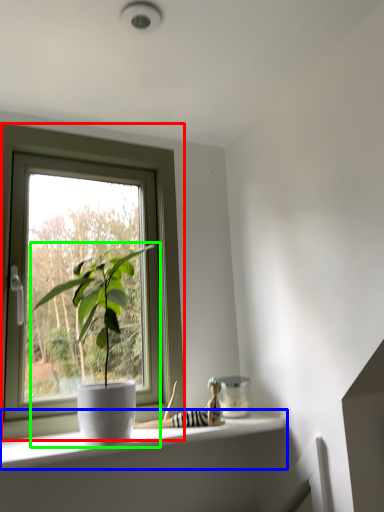
Question: Considering the real-world distances, which object is closest to window (highlighted by a red box)? window sill (highlighted by a blue box) or houseplant (highlighted by a green box).

Choices:
 (A) window sill
 (B) houseplant

Answer: (B)